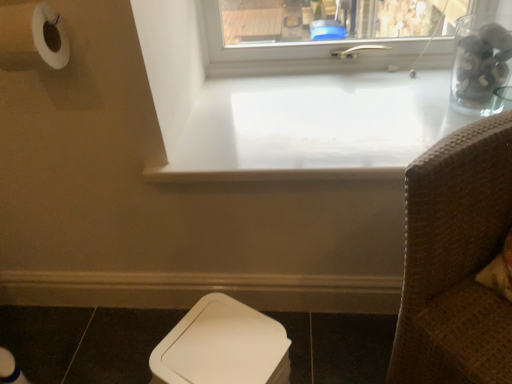
You are a GUI agent. You are given a task and a screenshot of the screen. Output one action in this format:
    pyautogui.click(x=<x>, y=<y>)
    Task: Click on the brown woven chair at right
    The width and height of the screenshot is (512, 384).
    Given the screenshot: What is the action you would take?
    pyautogui.click(x=456, y=260)

The height and width of the screenshot is (384, 512). What do you see at coordinates (479, 66) in the screenshot? I see `transparent glass jar at upper right` at bounding box center [479, 66].

What is the approximate height of white plastic toilet bowl at lower center?

white plastic toilet bowl at lower center is 11.18 inches tall.

This screenshot has height=384, width=512. What do you see at coordinates (315, 127) in the screenshot? I see `white glossy counter top at center` at bounding box center [315, 127].

This screenshot has height=384, width=512. I want to click on dark brown tile at lower left, so click(42, 339).

Which object is closer to the camera, white glossy counter top at center or dark brown tile at lower left?

dark brown tile at lower left is in front.

Is point (312, 121) in front of point (74, 313)?

Yes.

In the image, is white glossy counter top at center on the left side or the right side of dark brown tile at lower left?

In the image, white glossy counter top at center appears on the right side of dark brown tile at lower left.

From a real-world perspective, is white glossy counter top at center physically located above or below dark brown tile at lower left?

white glossy counter top at center is above dark brown tile at lower left.

From the picture: How far apart are clear glass jar at upper right and dark brown tile at lower left?

clear glass jar at upper right and dark brown tile at lower left are 36.98 inches apart.

From the image's perspective, relative to dark brown tile at lower left, is clear glass jar at upper right above or below?

Clearly, from the image's perspective, clear glass jar at upper right is above dark brown tile at lower left.

Is point (289, 44) closer or farther from the camera than point (38, 353)?

Point (289, 44) is positioned farther from the camera compared to point (38, 353).

From a real-world perspective, is clear glass jar at upper right above or below dark brown tile at lower left?

Clearly, from a real-world perspective, clear glass jar at upper right is above dark brown tile at lower left.

In the scene shown: Which is more to the left, white glossy counter top at center or brown woven chair at right?

white glossy counter top at center.

Is white glossy counter top at center positioned far away from brown woven chair at right?

white glossy counter top at center is actually quite close to brown woven chair at right.

From the image's perspective, is white glossy counter top at center above or below brown woven chair at right?

white glossy counter top at center is situated higher than brown woven chair at right in the image.

Is point (323, 108) positioned behind point (470, 287)?

That is True.

Consider the image. From the image's perspective, which one is positioned lower, white plastic toilet bowl at lower center or white glossy counter top at center?

white plastic toilet bowl at lower center appears lower in the image.

The image size is (512, 384). There is a white plastic toilet bowl at lower center. In order to click on counter top above it (from a real-world perspective) in this screenshot , I will do `click(315, 127)`.

Is white plastic toilet bowl at lower center positioned beyond the bounds of white glossy counter top at center?

Yes, white plastic toilet bowl at lower center is outside of white glossy counter top at center.

In the scene shown: Are white plastic toilet bowl at lower center and white glossy counter top at center far apart?

That's not correct — white plastic toilet bowl at lower center is a little close to white glossy counter top at center.

Who is bigger, dark brown tile at lower left or white plastic toilet bowl at lower center?

white plastic toilet bowl at lower center.

Does point (26, 313) appear closer or farther from the camera than point (201, 361)?

Clearly, point (26, 313) is more distant from the camera than point (201, 361).

From a real-world perspective, which is physically below, dark brown tile at lower left or white plastic toilet bowl at lower center?

dark brown tile at lower left.

Can white plastic toilet bowl at lower center be found inside dark brown tile at lower left?

Actually, white plastic toilet bowl at lower center is outside dark brown tile at lower left.

Is transparent glass jar at upper right looking in the opposite direction of dark brown tile at lower left?

No, transparent glass jar at upper right's orientation is not away from dark brown tile at lower left.

Does point (481, 82) come closer to viewer compared to point (1, 312)?

That is True.

From the image's perspective, which is above, transparent glass jar at upper right or dark brown tile at lower left?

transparent glass jar at upper right is shown above in the image.

Looking at this image, would you say transparent glass jar at upper right is outside dark brown tile at lower left?

That's correct, transparent glass jar at upper right is outside of dark brown tile at lower left.

Considering the relative sizes of transparent glass jar at upper right and white plastic toilet bowl at lower center in the image provided, is transparent glass jar at upper right thinner than white plastic toilet bowl at lower center?

Yes.

In the scene shown: Can you see transparent glass jar at upper right touching white plastic toilet bowl at lower center?

No, transparent glass jar at upper right is not beside white plastic toilet bowl at lower center.

Which is less distant, (x=505, y=64) or (x=164, y=383)?

The point (x=164, y=383) is more forward.

Considering the positions of objects transparent glass jar at upper right and white plastic toilet bowl at lower center in the image provided, who is behind, transparent glass jar at upper right or white plastic toilet bowl at lower center?

transparent glass jar at upper right is further away from the camera.

The image size is (512, 384). Identify the location of tile on the left of the white glossy counter top at center. (42, 339).

Image resolution: width=512 pixels, height=384 pixels. In order to click on window above the dark brown tile at lower left (from the image's perspective) in this screenshot , I will do `click(289, 47)`.

Estimate the real-world distances between objects in this image. Which object is further from white glossy counter top at center, transparent glass jar at upper right or dark brown tile at lower left?

Among the two, dark brown tile at lower left is located further to white glossy counter top at center.

From the image, which object appears to be nearer to white plastic toilet bowl at lower center, clear glass jar at upper right or brown woven chair at right?

brown woven chair at right.

Based on their spatial positions, is white plastic toilet bowl at lower center or transparent glass jar at upper right closer to white glossy counter top at center?

Among the two, transparent glass jar at upper right is located nearer to white glossy counter top at center.

Looking at this image, estimate the real-world distances between objects in this image. Which object is further from white glossy counter top at center, white plastic toilet bowl at lower center or dark brown tile at lower left?

The object further to white glossy counter top at center is dark brown tile at lower left.

Based on their spatial positions, is brown woven chair at right or transparent glass jar at upper right further from clear glass jar at upper right?

brown woven chair at right is positioned further to the anchor clear glass jar at upper right.

Which object lies nearer to the anchor point white glossy counter top at center, clear glass jar at upper right or transparent glass jar at upper right?

Based on the image, clear glass jar at upper right appears to be nearer to white glossy counter top at center.

Based on their spatial positions, is dark brown tile at lower left or white glossy counter top at center closer to transparent glass jar at upper right?

white glossy counter top at center lies closer to transparent glass jar at upper right than the other object.

When comparing their distances from brown woven chair at right, does white glossy counter top at center or dark brown tile at lower left seem further?

dark brown tile at lower left lies further to brown woven chair at right than the other object.

Where is `furniture situated between dark brown tile at lower left and transparent glass jar at upper right from left to right`? The image size is (512, 384). furniture situated between dark brown tile at lower left and transparent glass jar at upper right from left to right is located at coordinates point(456,260).

Where is `window situated between dark brown tile at lower left and transparent glass jar at upper right from left to right`? window situated between dark brown tile at lower left and transparent glass jar at upper right from left to right is located at coordinates (289, 47).

Locate an element on the screen. This screenshot has width=512, height=384. glass vase between clear glass jar at upper right and white plastic toilet bowl at lower center vertically is located at coordinates (479, 66).

The height and width of the screenshot is (384, 512). In order to click on toilet bowl between white glossy counter top at center and dark brown tile at lower left in the vertical direction in this screenshot , I will do `click(222, 346)`.